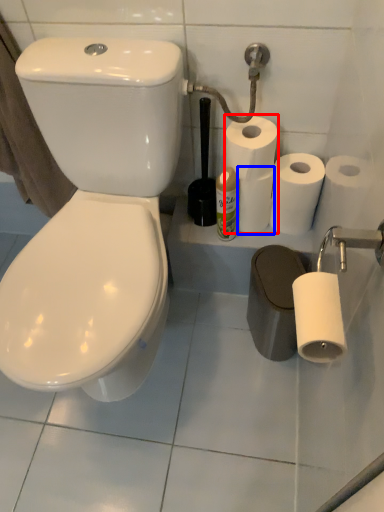
Question: Which object is closer to the camera taking this photo, toilet paper (highlighted by a red box) or paper towel (highlighted by a blue box)?

Choices:
 (A) toilet paper
 (B) paper towel

Answer: (A)